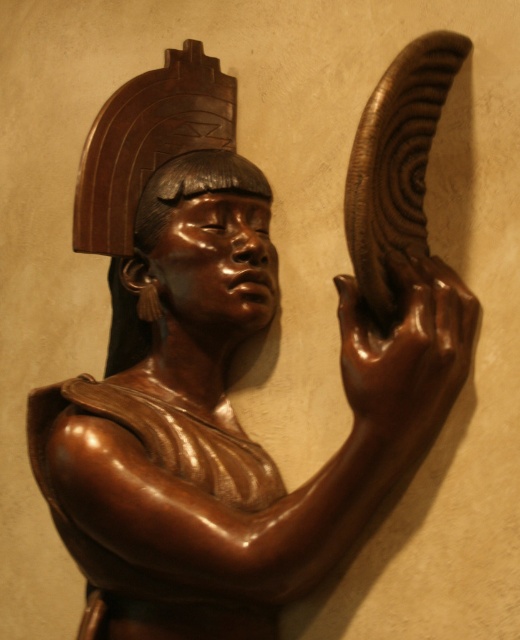
Which is more to the right, shiny brown hand at upper right or matte brown head at center?

From the viewer's perspective, shiny brown hand at upper right appears more on the right side.

Between shiny brown hand at upper right and matte brown head at center, which one is positioned lower?

shiny brown hand at upper right is below.

Locate an element on the screen. shiny brown hand at upper right is located at coordinates (408, 348).